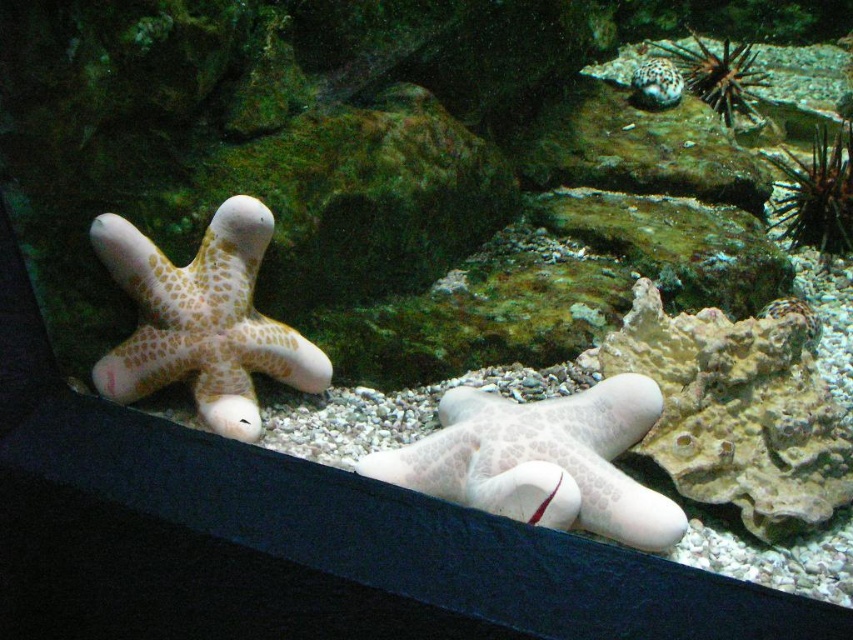
Does leathery beige starfish at left have a greater height compared to sandy textured starfish at upper right?

Yes.

Describe the element at coordinates (202, 321) in the screenshot. I see `leathery beige starfish at left` at that location.

Is point (209, 280) positioned after point (650, 99)?

No, (209, 280) is in front of (650, 99).

Where is `leathery beige starfish at left`? The image size is (853, 640). leathery beige starfish at left is located at coordinates (202, 321).

Can you confirm if white matte starfish at center is thinner than brown spiky sea urchin at right?

In fact, white matte starfish at center might be wider than brown spiky sea urchin at right.

Between point (436, 468) and point (830, 147), which one is positioned in front?

Point (436, 468) is more forward.

Locate an element on the screen. The width and height of the screenshot is (853, 640). white matte starfish at center is located at coordinates (543, 460).

I want to click on white matte starfish at center, so click(x=543, y=460).

Between speckled white starfish at upper right and sandy textured starfish at upper right, which one appears on the left side from the viewer's perspective?

Positioned to the left is sandy textured starfish at upper right.

Is the position of speckled white starfish at upper right less distant than that of sandy textured starfish at upper right?

No, it is behind sandy textured starfish at upper right.

Is point (747, 90) farther from camera compared to point (639, 81)?

Yes.

Locate an element on the screen. This screenshot has height=640, width=853. speckled white starfish at upper right is located at coordinates (718, 76).